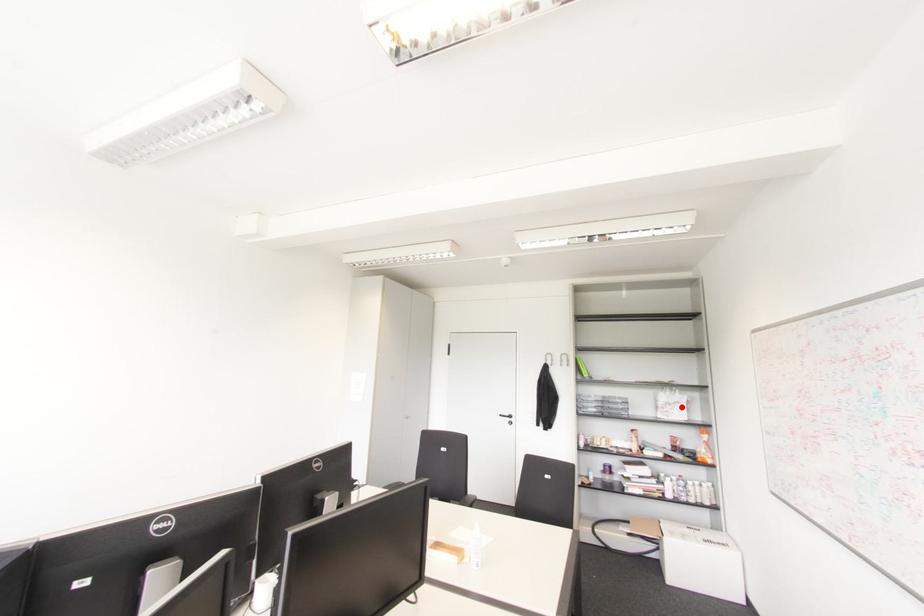
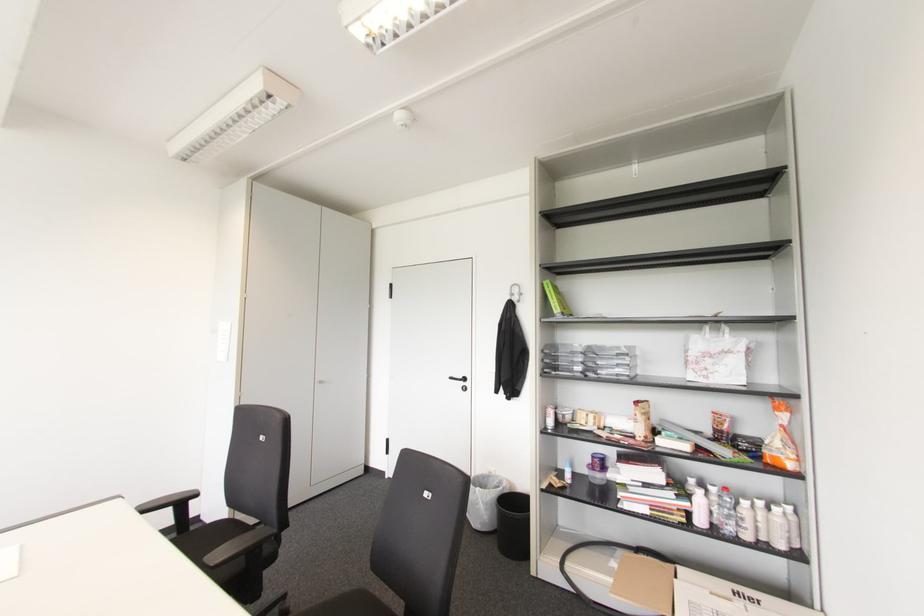
The point at the highlighted location is marked in the first image. Where is the corresponding point in the second image?

(735, 361)